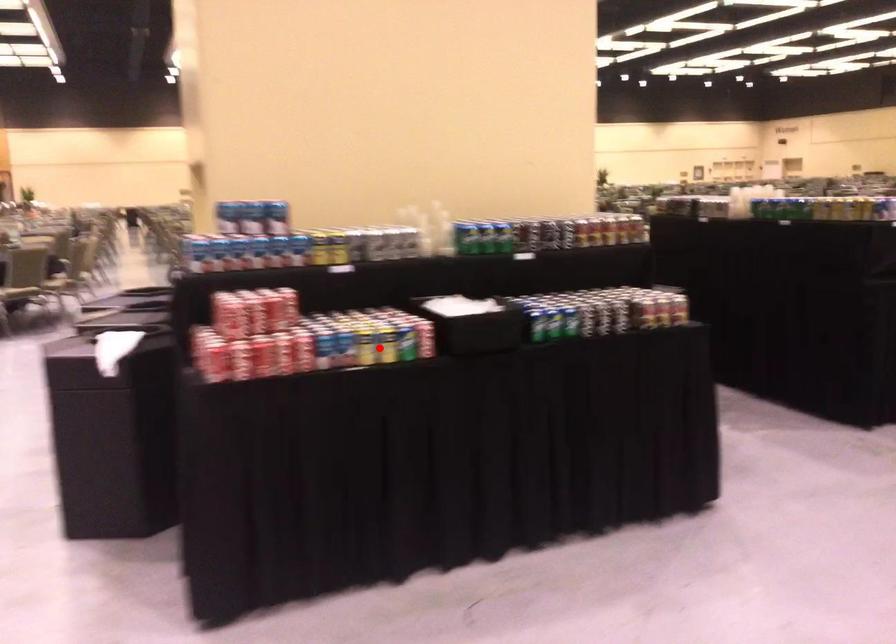
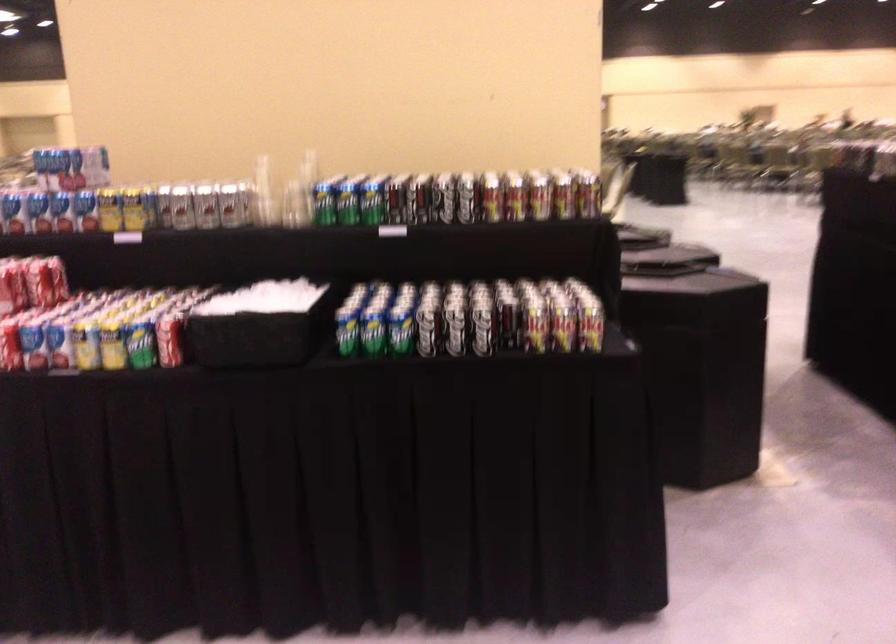
Find the pixel in the second image that matches the highlighted location in the first image.

(112, 346)